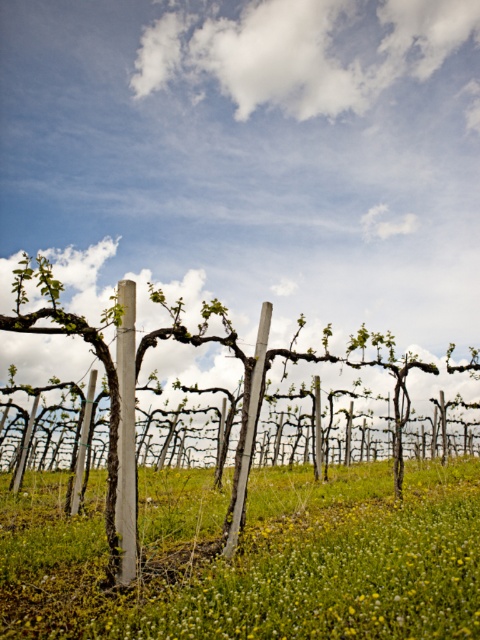
Question: Can you confirm if white wood pole at center is smaller than smooth gray pole at center?

Choices:
 (A) yes
 (B) no

Answer: (A)

Question: Does green grassy at center have a larger size compared to green wood vine at center?

Choices:
 (A) no
 (B) yes

Answer: (B)

Question: Which of the following is the farthest from the observer?

Choices:
 (A) green grassy at center
 (B) white wood pole at center

Answer: (B)

Question: Which of the following is the farthest from the observer?

Choices:
 (A) green grassy at center
 (B) white wood pole at center

Answer: (B)

Question: Does wooden posts at center have a greater width compared to smooth gray pole at center?

Choices:
 (A) yes
 (B) no

Answer: (A)

Question: Which object appears farthest from the camera in this image?

Choices:
 (A) wooden posts at center
 (B) green grassy at center
 (C) smooth gray pole at center

Answer: (C)